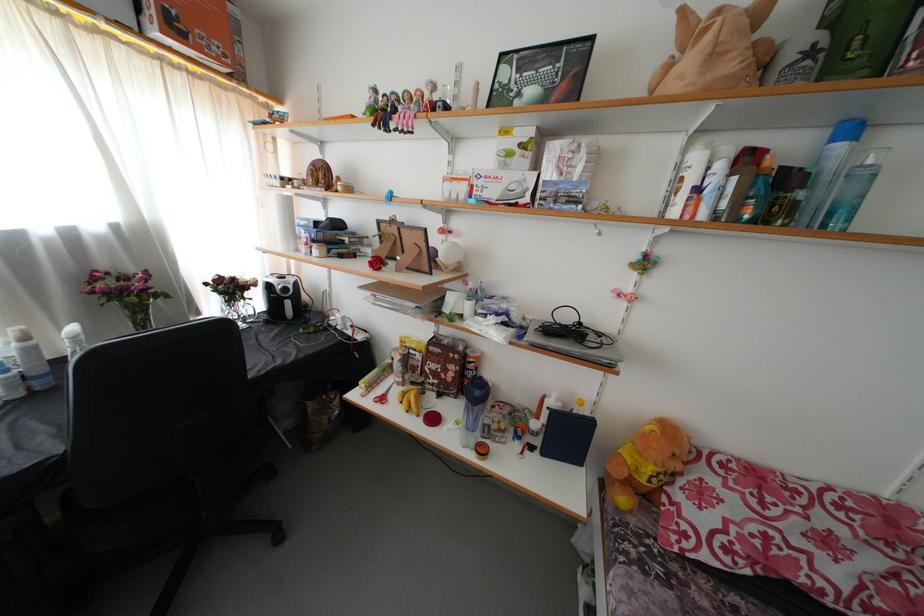
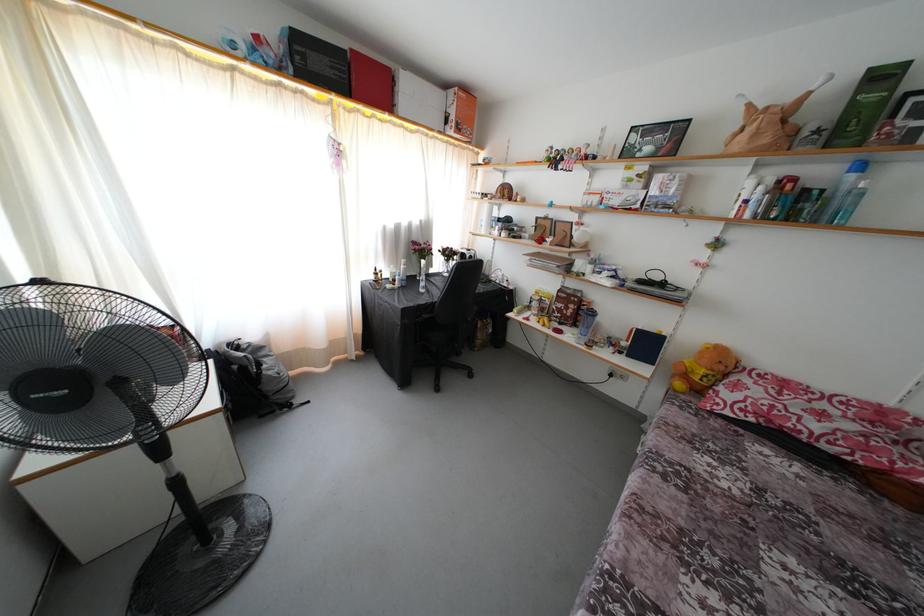
Locate, in the second image, the point that corresponds to point (831, 138) in the first image.

(849, 172)